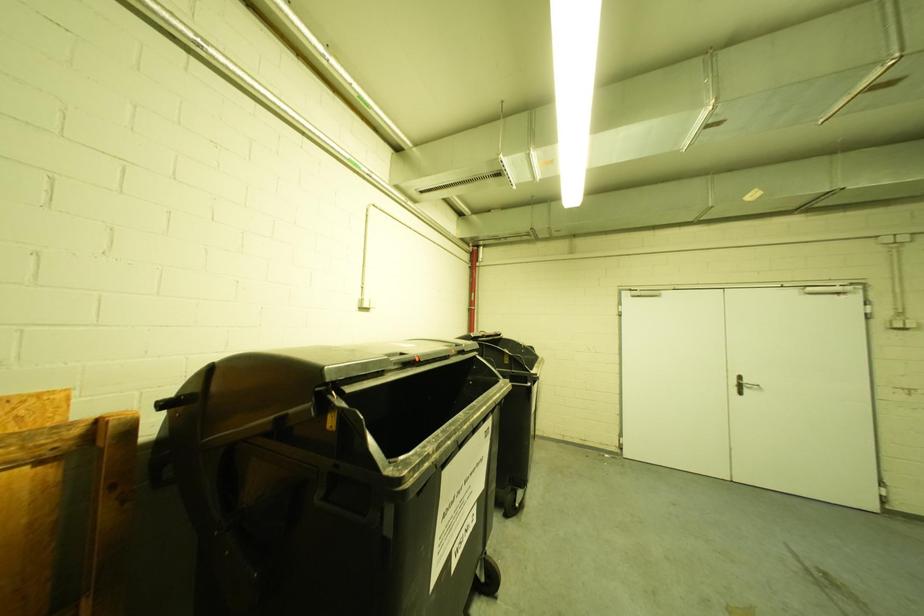
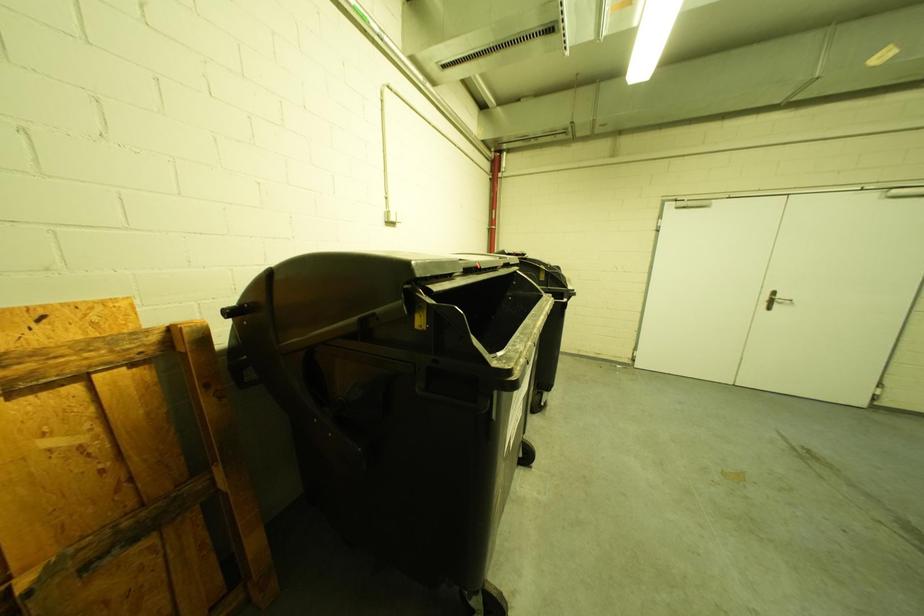
Question: Based on the continuous images, in which direction is the camera rotating? Reply with the corresponding letter.

Choices:
 (A) Left
 (B) Right
 (C) Up
 (D) Down

Answer: (D)